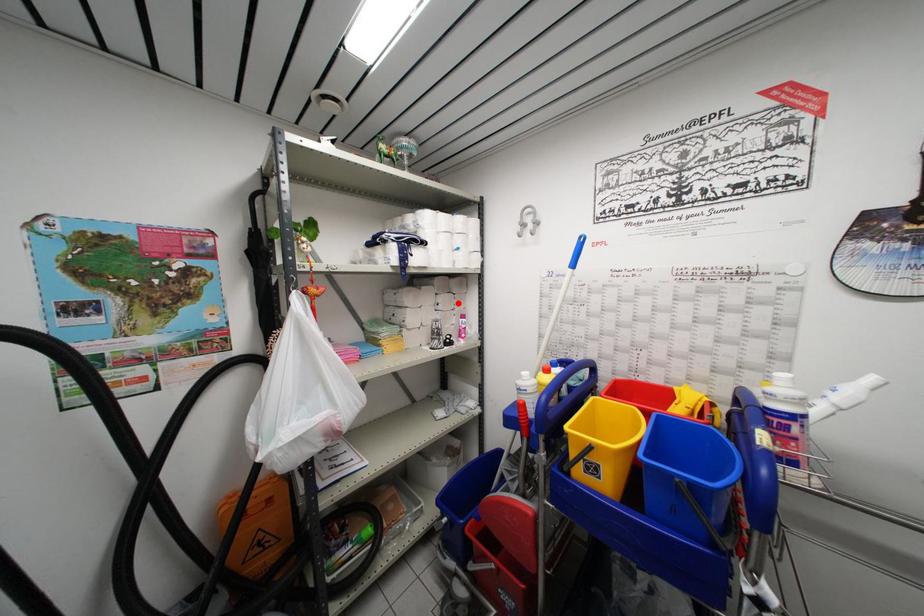
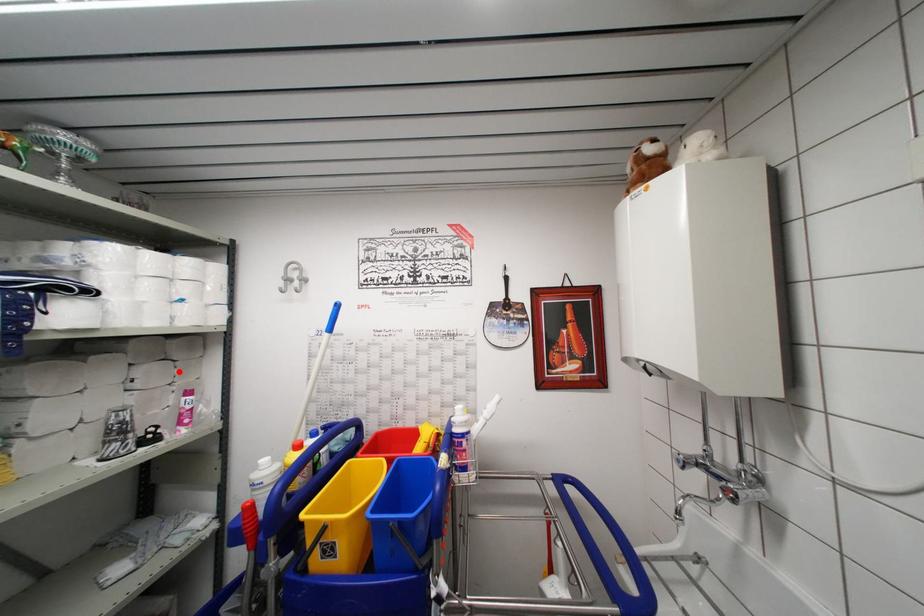
I am providing you with two images of the same scene from different viewpoints. A red point is marked on the first image and another point is marked on the second image. Does the point marked in image1 correspond to the same location as the one in image2?

Yes